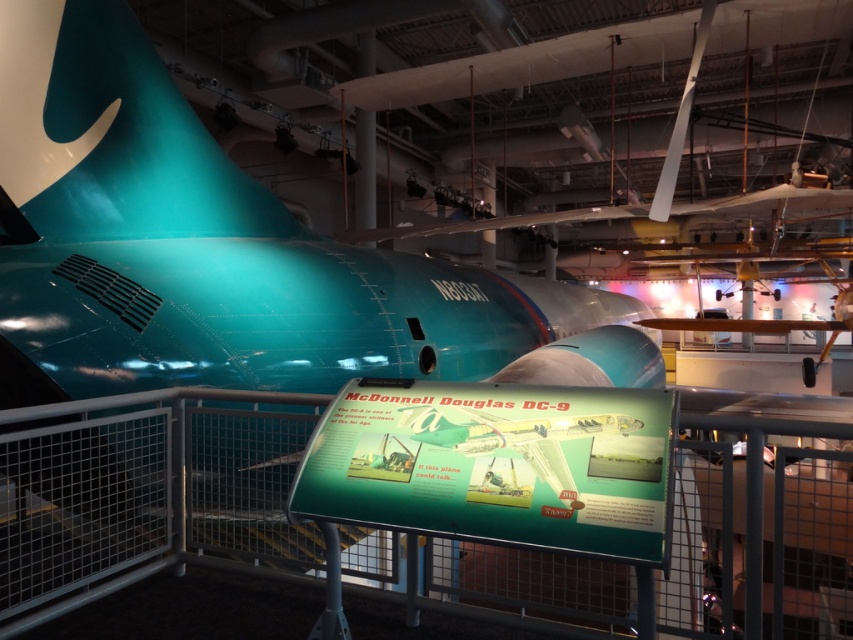
Does point (573, 292) come behind point (675, 323)?

No, (573, 292) is closer to viewer.

Between teal glossy airplane at center and wooden propeller at upper center, which one has more height?

Standing taller between the two is wooden propeller at upper center.

What do you see at coordinates (225, 253) in the screenshot? I see `teal glossy airplane at center` at bounding box center [225, 253].

Find the location of a particular element. teal glossy airplane at center is located at coordinates (225, 253).